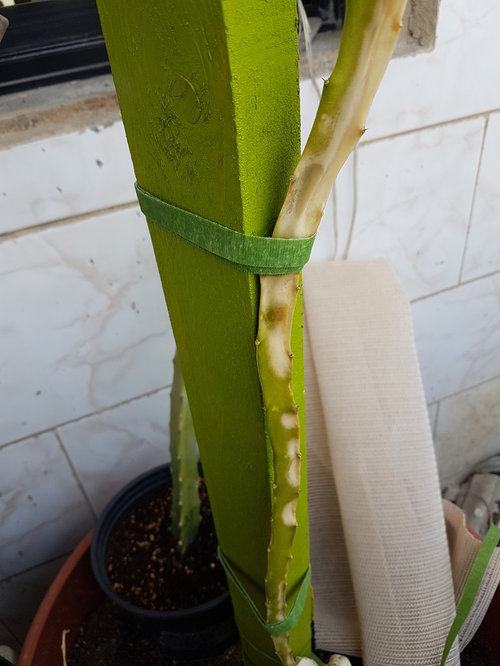
Find the location of a particular element. 1 plant attached to green string is located at coordinates (280, 539).